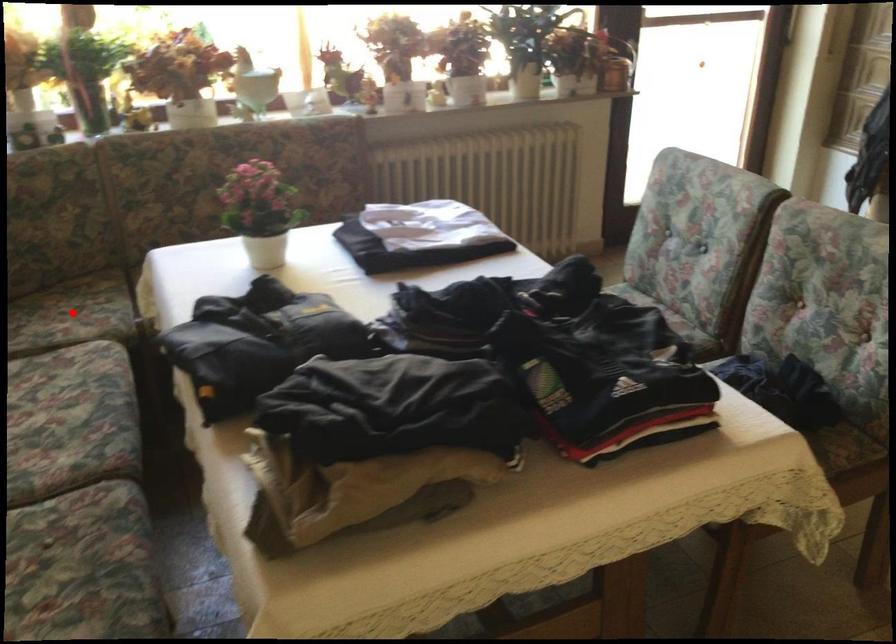
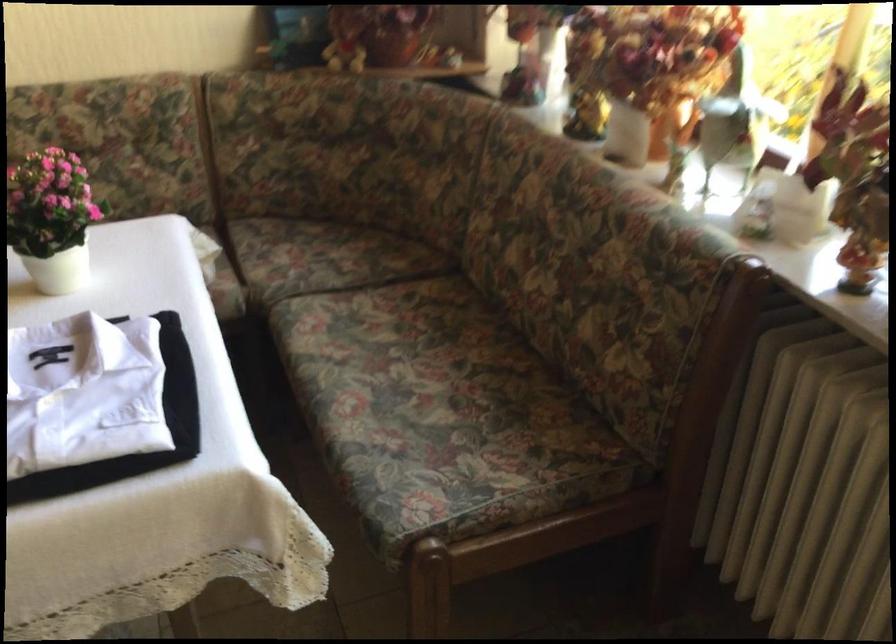
Locate, in the second image, the point that corresponds to the highlighted location in the first image.

(306, 252)